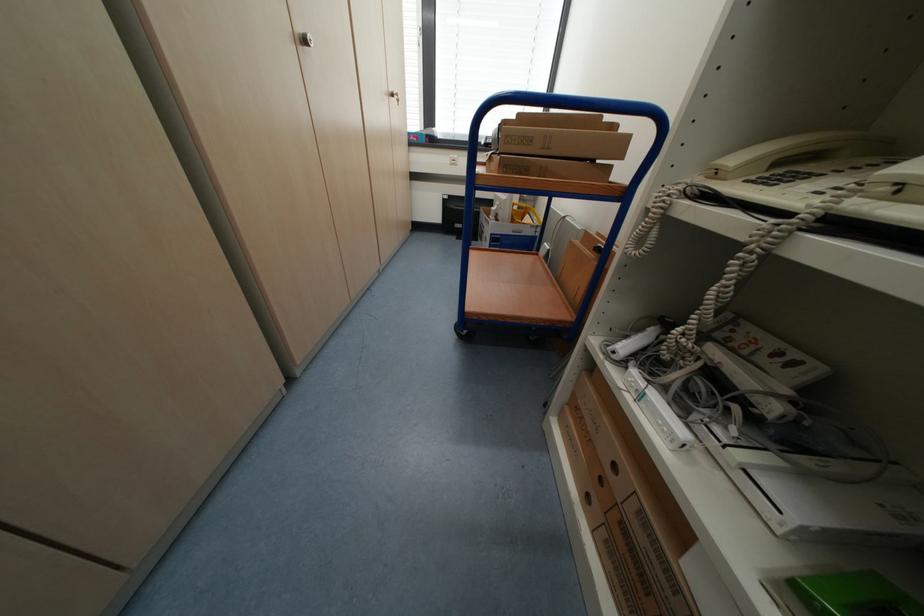
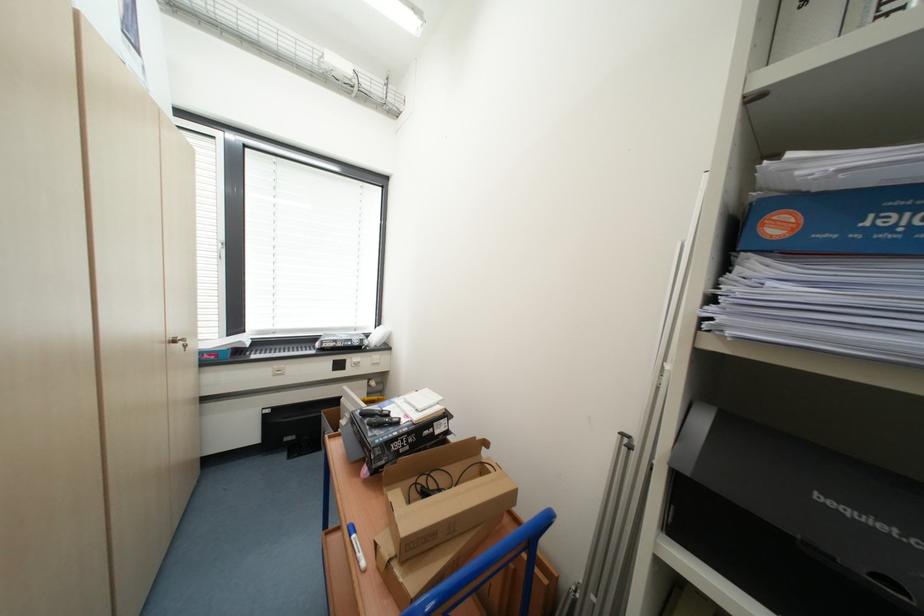
Based on the photo, first-person continuous shooting, in which direction is the camera rotating?

The camera's rotation is toward right-up.